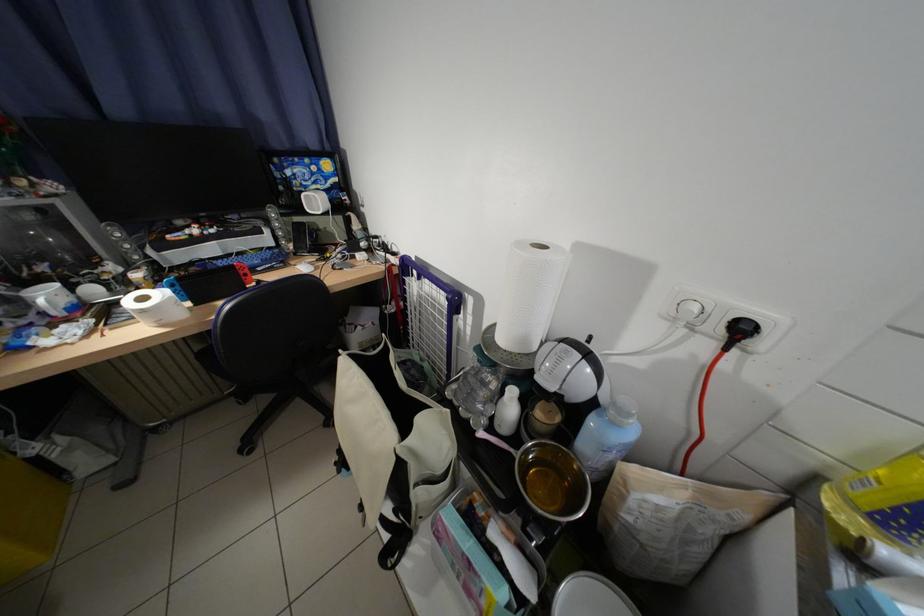
This screenshot has width=924, height=616. Describe the element at coordinates (391, 435) in the screenshot. I see `the white bag handle` at that location.